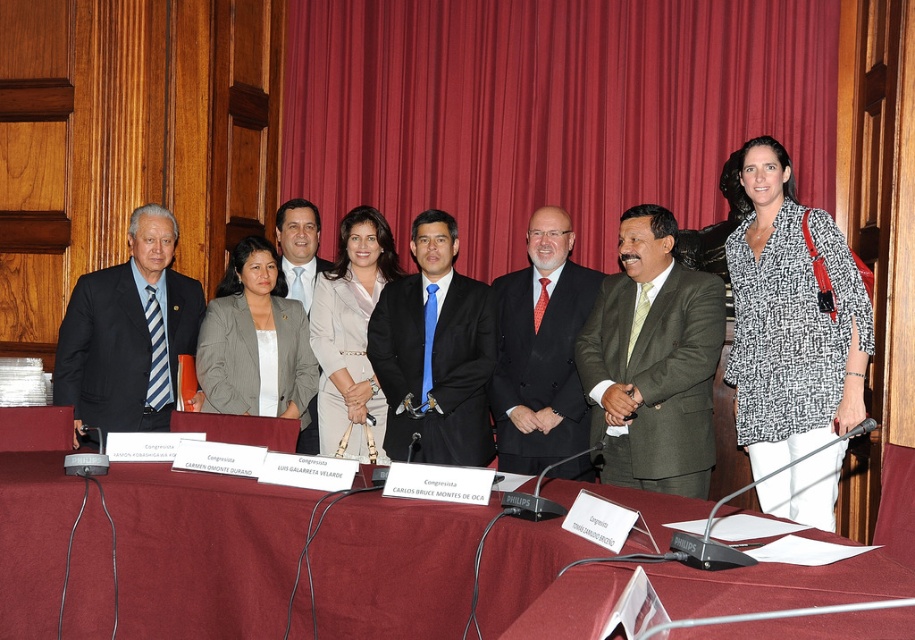
In the formal group photo, there is a point marked at coordinates (299,248). Which object from the scene is located exactly at this point?

The point at (299,248) indicates the light beige suit at center.

In the group photo, there are two points marked at coordinates point [458,157] and point [184,300]. Based on their positions, which point is located behind the other?

Point [458,157] is behind point [184,300].

You are a photographer setting up for an event. You notice the red velvet curtain at upper center and the matte black suit at left in the background. Which object is positioned higher in the image?

The red velvet curtain at upper center is located above the matte black suit at left, so it is positioned higher in the image.